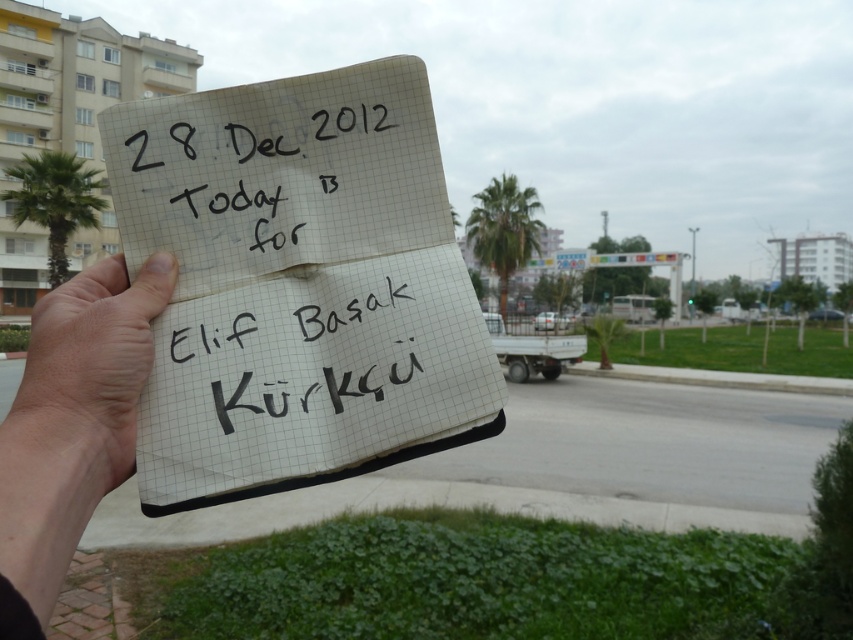
Question: Is white paper at center above dry skin at center?

Choices:
 (A) yes
 (B) no

Answer: (A)

Question: Among these objects, which one is farthest from the camera?

Choices:
 (A) green leafy palm tree at upper center
 (B) black paper at center
 (C) dry skin at center

Answer: (A)

Question: Which object is the farthest from the green leafy palm tree at upper center?

Choices:
 (A) dry skin at center
 (B) green leafy palm tree at left

Answer: (A)

Question: Considering the relative positions of black paper at center and green leafy palm tree at upper center in the image provided, where is black paper at center located with respect to green leafy palm tree at upper center?

Choices:
 (A) left
 (B) right

Answer: (A)

Question: Among these points, which one is nearest to the camera?

Choices:
 (A) (384, 188)
 (B) (265, 371)
 (C) (486, 221)
 (D) (77, 170)

Answer: (B)

Question: Can you confirm if black paper at center is bigger than green leafy palm tree at upper center?

Choices:
 (A) yes
 (B) no

Answer: (B)